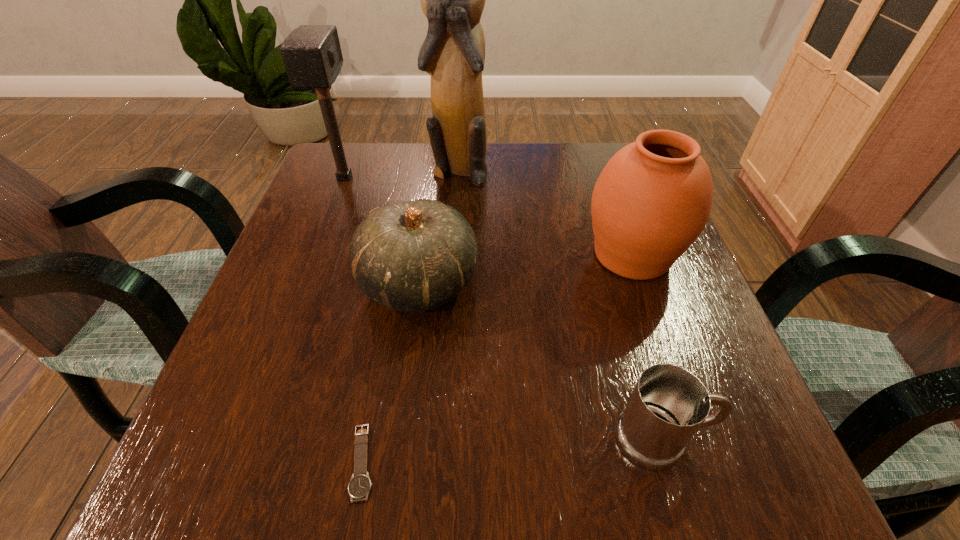
What are the coordinates of `vacant position located on the back of the gourd` in the screenshot? It's located at (438, 144).

This screenshot has width=960, height=540. Find the location of `free space located 0.050m on the side of the second shortest object with the handle`. free space located 0.050m on the side of the second shortest object with the handle is located at coordinates (744, 439).

You are a GUI agent. You are given a task and a screenshot of the screen. Output one action in this format:
    pyautogui.click(x=<x>, y=<y>)
    Task: Click on the vacant space located 0.110m on the right of the shortest object
    Image resolution: width=960 pixels, height=540 pixels.
    Given the screenshot: What is the action you would take?
    pyautogui.click(x=461, y=462)

This screenshot has height=540, width=960. Identify the location of cat that is at the far edge. (453, 53).

Locate an element on the screen. The image size is (960, 540). mallet that is at the far edge is located at coordinates (312, 55).

Where is `mug that is at the near edge`? mug that is at the near edge is located at coordinates (669, 404).

Locate an element on the screen. The height and width of the screenshot is (540, 960). watch that is at the near edge is located at coordinates (x=360, y=484).

This screenshot has height=540, width=960. Identify the location of object at the left edge. (312, 55).

Locate an element on the screen. The image size is (960, 540). urn that is at the right edge is located at coordinates (652, 200).

Locate an element on the screen. mug at the right edge is located at coordinates point(669,404).